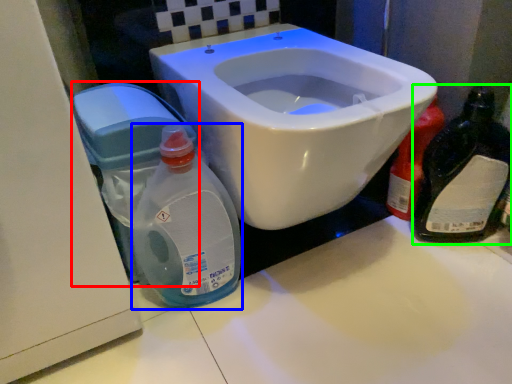
Question: Which object is the closest to the water tank (highlighted by a red box)? Choose among these: baby bottle (highlighted by a blue box) or bottle (highlighted by a green box).

Choices:
 (A) baby bottle
 (B) bottle

Answer: (A)